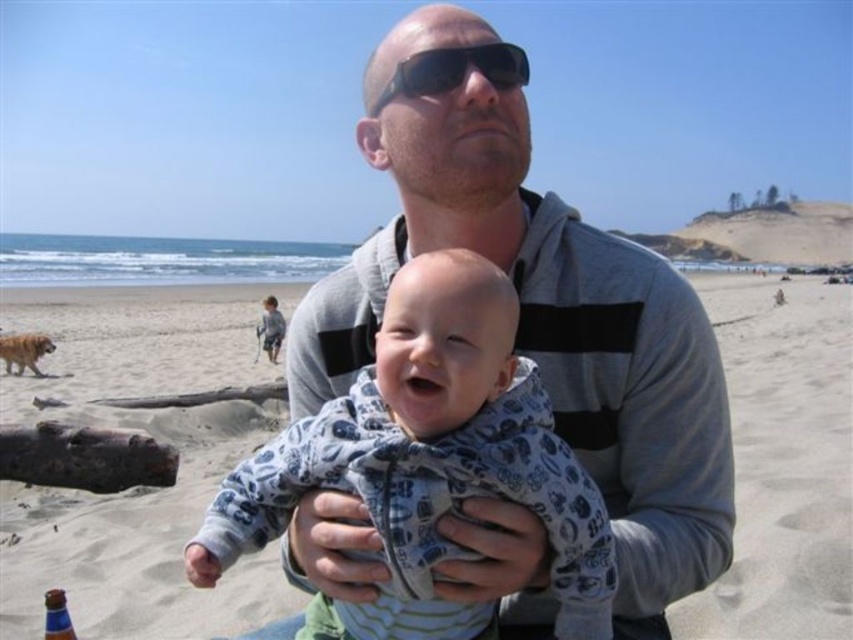
You are a fashion designer observing the beach scene. You want to create a new clothing line inspired by the gray hoodie at center and the black plastic sunglasses at upper center. Which item should you prioritize in your design if you want to emphasize size differences between the two?

The gray hoodie at center is larger in size than the black plastic sunglasses at upper center, so you should prioritize the gray hoodie at center in your design to emphasize the size difference between the two items.